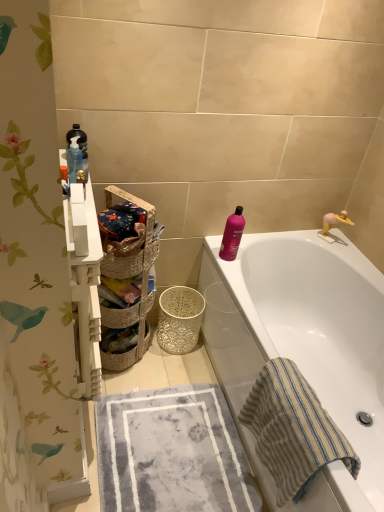
I want to click on beige striped towel at lower right, the second beach towel viewed from the left, so click(293, 430).

Locate an element on the screen. The height and width of the screenshot is (512, 384). gray textured towel at lower center, which is the 1th beach towel in left-to-right order is located at coordinates (172, 453).

What do you see at coordinates (172, 453) in the screenshot? Image resolution: width=384 pixels, height=512 pixels. I see `gray textured towel at lower center, positioned as the 2th beach towel in right-to-left order` at bounding box center [172, 453].

You are a GUI agent. You are given a task and a screenshot of the screen. Output one action in this format:
    pyautogui.click(x=<x>, y=<y>)
    Task: Click on the woven beige basket at left
    This screenshot has height=512, width=384.
    Given the screenshot: What is the action you would take?
    pyautogui.click(x=129, y=278)

You are a GUI agent. You are given a task and a screenshot of the screen. Output one action in this format:
    pyautogui.click(x=<x>, y=<y>)
    Task: Click on the pink glossy bottle at upper right, the 1th cleaning product positioned from the back
    
    Given the screenshot: What is the action you would take?
    pyautogui.click(x=232, y=234)

You are a GUI agent. You are given a task and a screenshot of the screen. Output one action in this format:
    pyautogui.click(x=<x>, y=<y>)
    Task: Click on the bathtub on the right of woven beige basket at left
    This screenshot has height=512, width=384.
    Given the screenshot: What is the action you would take?
    pyautogui.click(x=306, y=346)

Consider the image. Considering the sizes of objects white glossy bathtub at upper right and woven beige basket at left in the image provided, who is shorter, white glossy bathtub at upper right or woven beige basket at left?

white glossy bathtub at upper right is shorter.

Is woven beige basket at left located within white glossy bathtub at upper right?

That's incorrect, woven beige basket at left is not inside white glossy bathtub at upper right.

What's the angular difference between white glossy bathtub at upper right and woven beige basket at left's facing directions?

130 degrees.

Who is shorter, translucent plastic bottles at upper left, which is counted as the second cleaning product, starting from the bottom, or white glossy bathtub at upper right?

With less height is translucent plastic bottles at upper left, which is counted as the second cleaning product, starting from the bottom.

Starting from the white glossy bathtub at upper right, which cleaning product is the 1st one behind? Please provide its 2D coordinates.

[(76, 153)]

Looking at this image, is translucent plastic bottles at upper left, placed as the 2th cleaning product when sorted from back to front, situated inside white glossy bathtub at upper right or outside?

translucent plastic bottles at upper left, placed as the 2th cleaning product when sorted from back to front, cannot be found inside white glossy bathtub at upper right.

How many degrees apart are the facing directions of translucent plastic bottles at upper left, marked as the 1th cleaning product in a front-to-back arrangement, and white glossy bathtub at upper right?

There is a 178-degree angle between the facing directions of translucent plastic bottles at upper left, marked as the 1th cleaning product in a front-to-back arrangement, and white glossy bathtub at upper right.

Is point (250, 485) closer to viewer compared to point (138, 200)?

Yes, it is in front of point (138, 200).

Can you confirm if gray textured towel at lower center, positioned as the 2th beach towel in right-to-left order, is thinner than woven beige basket at left?

No.

Which object is further away from the camera taking this photo, gray textured towel at lower center, positioned as the 2th beach towel in right-to-left order, or woven beige basket at left?

Positioned behind is woven beige basket at left.

In terms of height, does gray textured towel at lower center, which is the 1th beach towel in left-to-right order, look taller or shorter compared to woven beige basket at left?

Clearly, gray textured towel at lower center, which is the 1th beach towel in left-to-right order, is shorter compared to woven beige basket at left.

From a real-world perspective, is beige striped towel at lower right, which ranks as the first beach towel in right-to-left order, above or below woven natural basket at center, arranged as the second basket when viewed from the back?

Clearly, from a real-world perspective, beige striped towel at lower right, which ranks as the first beach towel in right-to-left order, is below woven natural basket at center, arranged as the second basket when viewed from the back.

Can you tell me how much beige striped towel at lower right, which ranks as the first beach towel in right-to-left order, and woven natural basket at center, positioned as the 1th basket in front-to-back order, differ in facing direction?

They differ by 136 degrees in their facing directions.

Is beige striped towel at lower right, the second beach towel viewed from the left, smaller than woven natural basket at center, positioned as the 1th basket in front-to-back order?

Actually, beige striped towel at lower right, the second beach towel viewed from the left, might be larger than woven natural basket at center, positioned as the 1th basket in front-to-back order.

Locate an element on the screen. the 1st basket behind the beige striped towel at lower right, the second beach towel viewed from the left, starting your count from the anchor is located at coordinates (123, 263).

Considering the positions of objects white glossy bathtub at upper right and gray textured towel at lower center, which is the 1th beach towel in left-to-right order, in the image provided, who is more to the right, white glossy bathtub at upper right or gray textured towel at lower center, which is the 1th beach towel in left-to-right order,?

white glossy bathtub at upper right is more to the right.

Can you tell me how much white glossy bathtub at upper right and gray textured towel at lower center, which is the 1th beach towel in left-to-right order, differ in facing direction?

The angle between the facing direction of white glossy bathtub at upper right and the facing direction of gray textured towel at lower center, which is the 1th beach towel in left-to-right order, is 88.6 degrees.

Based on the photo, does white glossy bathtub at upper right have a greater height compared to gray textured towel at lower center, which is the 1th beach towel in left-to-right order?

Yes, white glossy bathtub at upper right is taller than gray textured towel at lower center, which is the 1th beach towel in left-to-right order.

Does point (206, 422) come behind point (105, 260)?

That is True.

From the image's perspective, relative to woven natural basket at center, arranged as the second basket when viewed from the back, is gray textured towel at lower center, positioned as the 2th beach towel in right-to-left order, above or below?

gray textured towel at lower center, positioned as the 2th beach towel in right-to-left order, is situated lower than woven natural basket at center, arranged as the second basket when viewed from the back, in the image.

Is gray textured towel at lower center, positioned as the 2th beach towel in right-to-left order, facing towards woven natural basket at center, positioned as the 1th basket in front-to-back order?

No, gray textured towel at lower center, positioned as the 2th beach towel in right-to-left order, does not turn towards woven natural basket at center, positioned as the 1th basket in front-to-back order.

Is translucent plastic bottles at upper left, which is counted as the second cleaning product, starting from the bottom, positioned far away from woven brown basket at center, arranged as the 2th basket when viewed from the front?

translucent plastic bottles at upper left, which is counted as the second cleaning product, starting from the bottom, is near woven brown basket at center, arranged as the 2th basket when viewed from the front, not far away.

Does translucent plastic bottles at upper left, placed as the 2th cleaning product when sorted from back to front, turn towards woven brown basket at center, the first basket when ordered from back to front?

No, translucent plastic bottles at upper left, placed as the 2th cleaning product when sorted from back to front, is not aimed at woven brown basket at center, the first basket when ordered from back to front.

Which is more to the right, translucent plastic bottles at upper left, placed as the 2th cleaning product when sorted from back to front, or woven brown basket at center, the first basket when ordered from back to front?

woven brown basket at center, the first basket when ordered from back to front.

What's the angular difference between translucent plastic bottles at upper left, marked as the 2th cleaning product in a right-to-left arrangement, and woven brown basket at center, arranged as the 2th basket when viewed from the front,'s facing directions?

55.1 degrees.

Where is `bathtub directly beneath the woven beige basket at left (from a real-world perspective)`? This screenshot has height=512, width=384. bathtub directly beneath the woven beige basket at left (from a real-world perspective) is located at coordinates 306,346.

Identify the location of the 2nd cleaning product counting from the left of the white glossy bathtub at upper right. Image resolution: width=384 pixels, height=512 pixels. (76, 153).

From the image, which object appears to be nearer to white glossy bathtub at upper right, gray textured towel at lower center, which is the 1th beach towel in left-to-right order, or translucent plastic bottles at upper left, positioned as the first cleaning product in top-to-bottom order?

gray textured towel at lower center, which is the 1th beach towel in left-to-right order, lies closer to white glossy bathtub at upper right than the other object.

Looking at this image, from the image, which object appears to be nearer to translucent plastic bottles at upper left, which is counted as the first cleaning product, starting from the left, pink glossy bottle at upper right, which is the 2th cleaning product from front to back, or beige striped towel at lower right, the second beach towel viewed from the left?

The object closer to translucent plastic bottles at upper left, which is counted as the first cleaning product, starting from the left, is pink glossy bottle at upper right, which is the 2th cleaning product from front to back.

Considering their positions, is beige striped towel at lower right, the second beach towel viewed from the left, positioned closer to pink glossy bottle at upper right, which appears as the first cleaning product when ordered from the bottom, than white glossy bathtub at upper right?

white glossy bathtub at upper right lies closer to pink glossy bottle at upper right, which appears as the first cleaning product when ordered from the bottom, than the other object.

When comparing their distances from beige striped towel at lower right, which ranks as the first beach towel in right-to-left order, does gray textured towel at lower center, positioned as the 2th beach towel in right-to-left order, or pink glossy bottle at upper right, the 1th cleaning product positioned from the back, seem further?

Based on the image, pink glossy bottle at upper right, the 1th cleaning product positioned from the back, appears to be further to beige striped towel at lower right, which ranks as the first beach towel in right-to-left order.

Looking at the image, which one is located further to woven beige basket at left, white glossy bathtub at upper right or beige striped towel at lower right, the second beach towel viewed from the left?

Among the two, beige striped towel at lower right, the second beach towel viewed from the left, is located further to woven beige basket at left.

Looking at the image, which one is located closer to translucent plastic bottles at upper left, which is counted as the first cleaning product, starting from the left, pink glossy bottle at upper right, which appears as the first cleaning product when ordered from the bottom, or woven beige basket at left?

woven beige basket at left is positioned closer to the anchor translucent plastic bottles at upper left, which is counted as the first cleaning product, starting from the left.

Consider the image. Considering their positions, is woven beige basket at left positioned further to beige striped towel at lower right, which ranks as the first beach towel in right-to-left order, than pink glossy bottle at upper right, which is the second cleaning product in left-to-right order?

Among the two, woven beige basket at left is located further to beige striped towel at lower right, which ranks as the first beach towel in right-to-left order.

Based on their spatial positions, is woven brown basket at center, arranged as the 2th basket when viewed from the front, or gray textured towel at lower center, which is the 1th beach towel in left-to-right order, further from woven natural basket at center, arranged as the second basket when viewed from the back?

gray textured towel at lower center, which is the 1th beach towel in left-to-right order, lies further to woven natural basket at center, arranged as the second basket when viewed from the back, than the other object.

Find the location of a particular element. The image size is (384, 512). basket between woven beige basket at left and pink glossy bottle at upper right, which is the second cleaning product in left-to-right order, in the horizontal direction is located at coordinates (123, 263).

Locate an element on the screen. Image resolution: width=384 pixels, height=512 pixels. shopping basket between woven brown basket at center, arranged as the 2th basket when viewed from the front, and beige striped towel at lower right, the second beach towel viewed from the left, from left to right is located at coordinates (129, 278).

Where is `cleaning product located between woven brown basket at center, the first basket when ordered from back to front, and white glossy bathtub at upper right in the left-right direction`? cleaning product located between woven brown basket at center, the first basket when ordered from back to front, and white glossy bathtub at upper right in the left-right direction is located at coordinates (232, 234).

Identify the location of shopping basket between woven brown basket at center, the first basket when ordered from back to front, and pink glossy bottle at upper right, the 1th cleaning product positioned from the back, in the horizontal direction. The height and width of the screenshot is (512, 384). (129, 278).